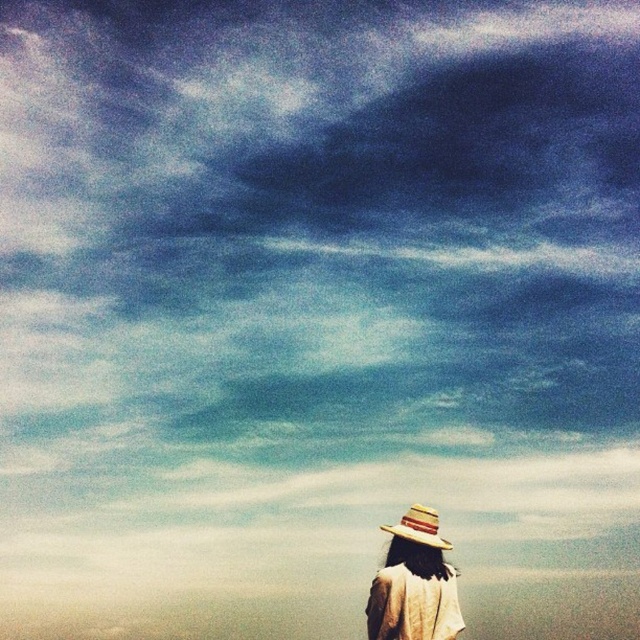
Between straw hat at lower center and natural straw hat at lower center, which one is positioned higher?

natural straw hat at lower center is higher up.

Does point (422, 580) come farther from viewer compared to point (385, 525)?

No, it is in front of (385, 525).

What are the coordinates of `straw hat at lower center` in the screenshot? It's located at (413, 582).